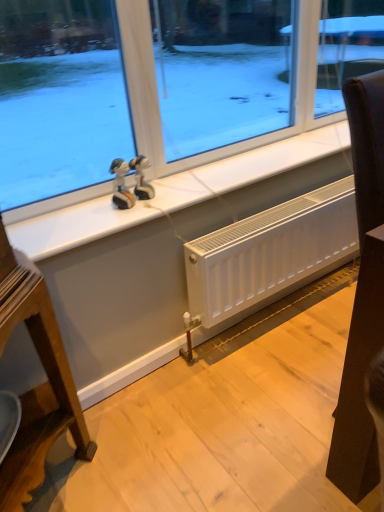
This screenshot has width=384, height=512. I want to click on empty space that is ontop of white tile at upper center, so click(x=214, y=170).